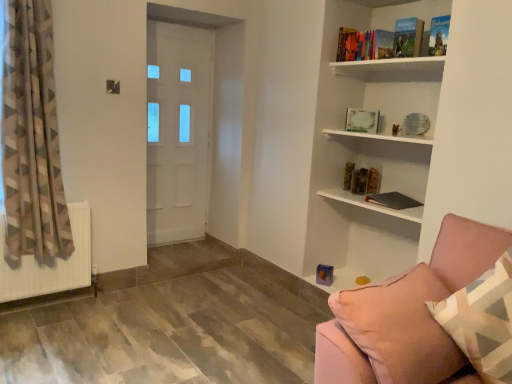
Identify the location of vacant space behind hardcover book at upper right, which ranks as the 2th book in top-to-bottom order. This screenshot has height=384, width=512. (402, 62).